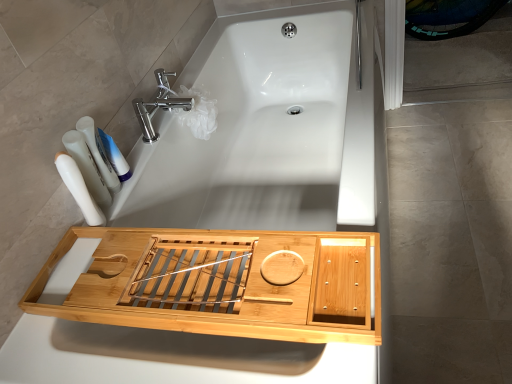
The width and height of the screenshot is (512, 384). I want to click on free location above natural wood tray at center (from a real-world perspective), so click(x=200, y=268).